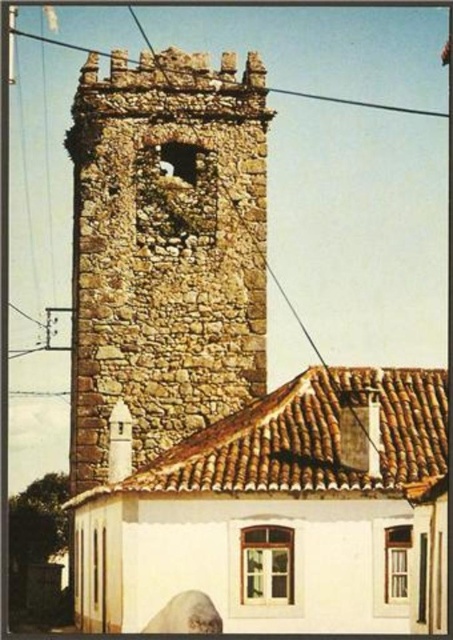
Question: Is brown stone tower at center positioned before metallic wire at upper center?

Choices:
 (A) no
 (B) yes

Answer: (B)

Question: Does brown stone tower at center appear on the left side of metallic wire at upper center?

Choices:
 (A) yes
 (B) no

Answer: (A)

Question: Is brown stone tower at center positioned behind metallic wire at upper center?

Choices:
 (A) yes
 (B) no

Answer: (B)